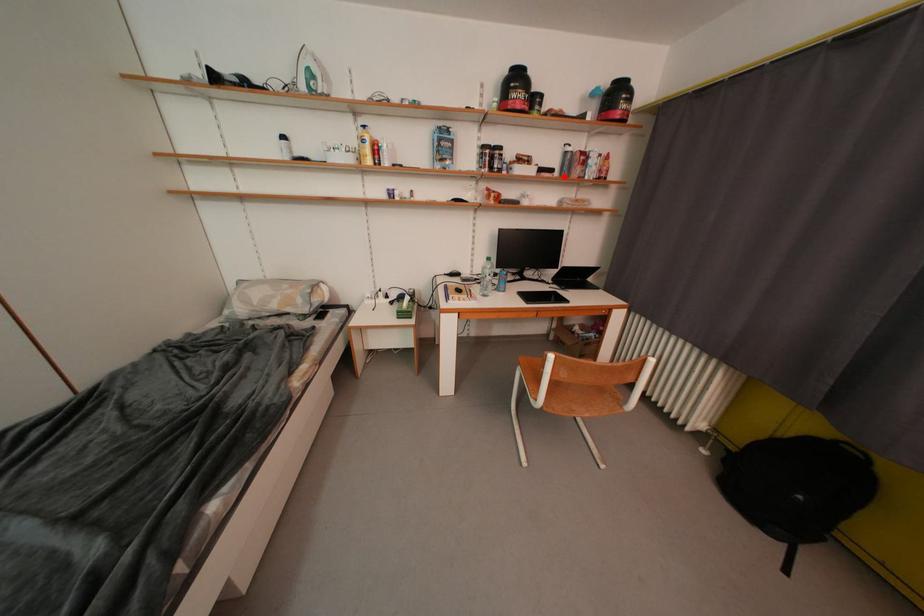
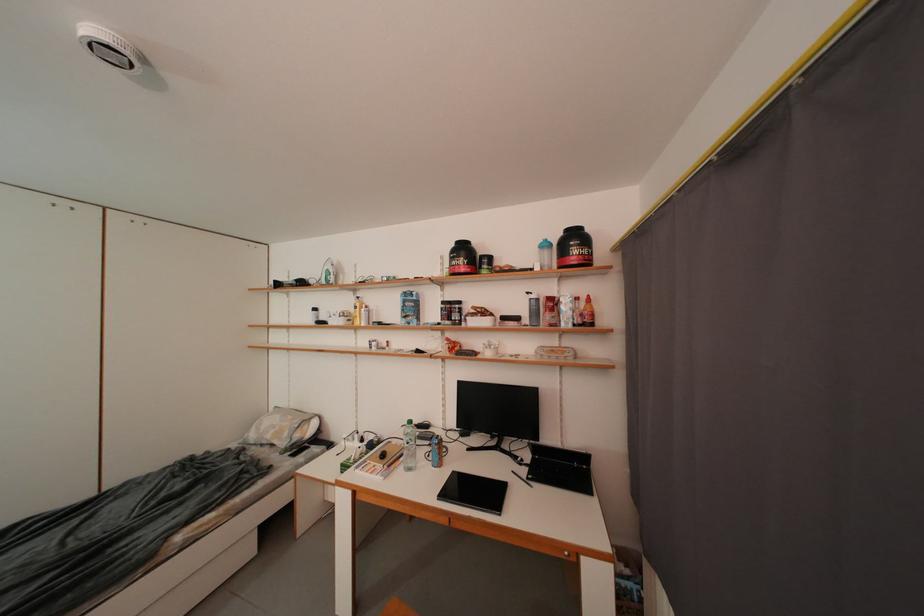
Find the pixel in the second image that matches the highlighted location in the first image.

(533, 323)